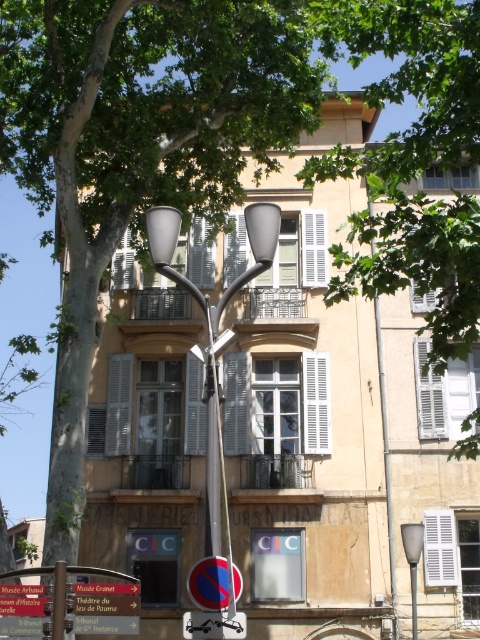
Measure the distance between green leafy tree at upper center and metallic reflective sign at lower center.

A distance of 22.74 meters exists between green leafy tree at upper center and metallic reflective sign at lower center.

Between green leafy tree at upper center and metallic reflective sign at lower center, which one appears on the left side from the viewer's perspective?

metallic reflective sign at lower center

Identify the location of green leafy tree at upper center. Image resolution: width=480 pixels, height=640 pixels. (411, 161).

Is point (460, 269) behind point (229, 620)?

Yes, point (460, 269) is farther from viewer.

Who is taller, green leafy tree at upper center or metallic reflective tow truck at lower center?

green leafy tree at upper center is taller.

Which is in front, point (322, 170) or point (222, 628)?

Point (222, 628) is in front.

Identify the location of green leafy tree at upper center. (411, 161).

Which is above, metallic reflective sign at lower center or matte gray streetlight at right?

Positioned higher is metallic reflective sign at lower center.

Where is `metallic reflective sign at lower center`? This screenshot has width=480, height=640. metallic reflective sign at lower center is located at coordinates (213, 582).